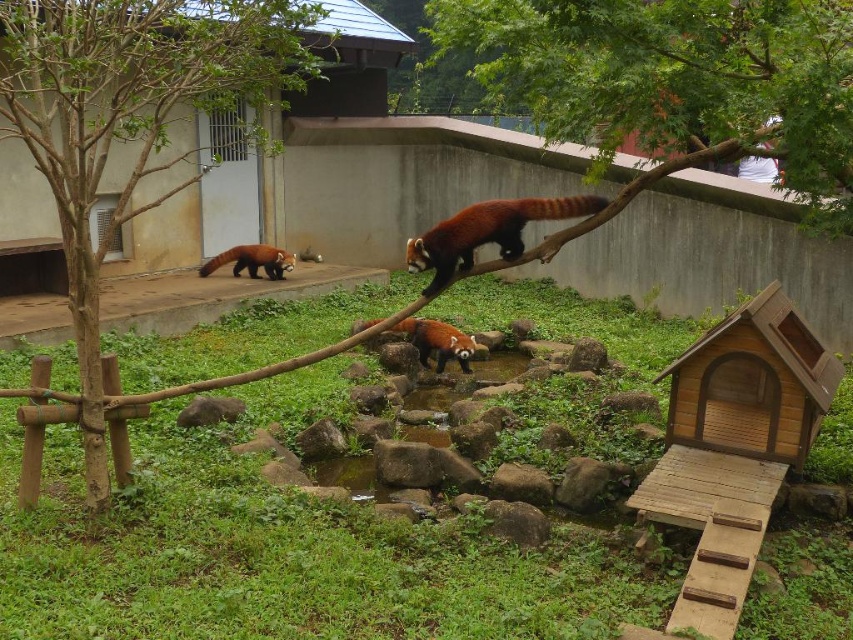
In the zoo enclosure for red pandas, there are two trees labeled as green leafy tree at upper center and green leafy tree at left. If a red panda wants to jump from one tree to another, which pair of trees are 2.32 meters apart?

The green leafy tree at upper center and the green leafy tree at left are 2.32 meters apart.

You are a zookeeper standing at the entrance of the red panda enclosure. You need to place a feeding tray for the pandas. The tray must be placed within 4 meters of the green leafy tree at upper center to ensure the pandas can easily reach it. Can you place the feeding tray at the entrance?

The green leafy tree at upper center is 3.82 meters away from the viewer. Since the entrance is where you are standing, placing the feeding tray there would be within the 4 meter requirement, so yes, you can place the feeding tray at the entrance.